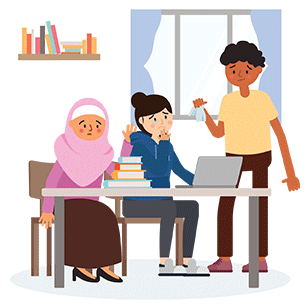
The height and width of the screenshot is (306, 306). In order to click on red books in this screenshot , I will do `click(117, 166)`, `click(28, 43)`, `click(37, 43)`, `click(56, 44)`, `click(90, 40)`, `click(65, 52)`.